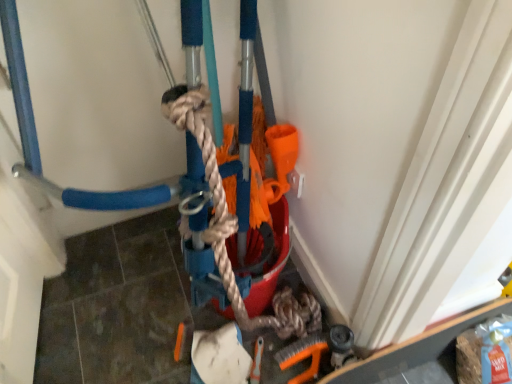
What do you see at coordinates (234, 226) in the screenshot? I see `white rope at center` at bounding box center [234, 226].

Image resolution: width=512 pixels, height=384 pixels. I want to click on white rope at center, so click(x=234, y=226).

The image size is (512, 384). What are the coordinates of `white rope at center` in the screenshot? It's located at (x=234, y=226).